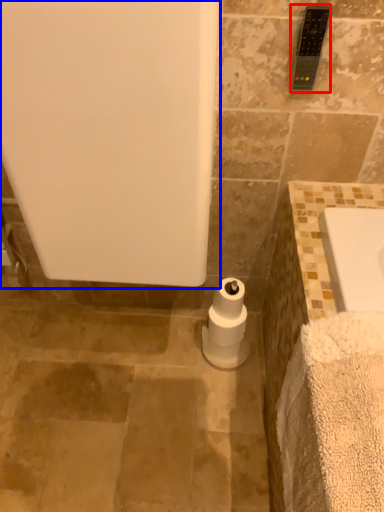
Question: Which point is closer to the camera, towel bar (highlighted by a red box) or bath (highlighted by a blue box)?

Choices:
 (A) towel bar
 (B) bath

Answer: (B)